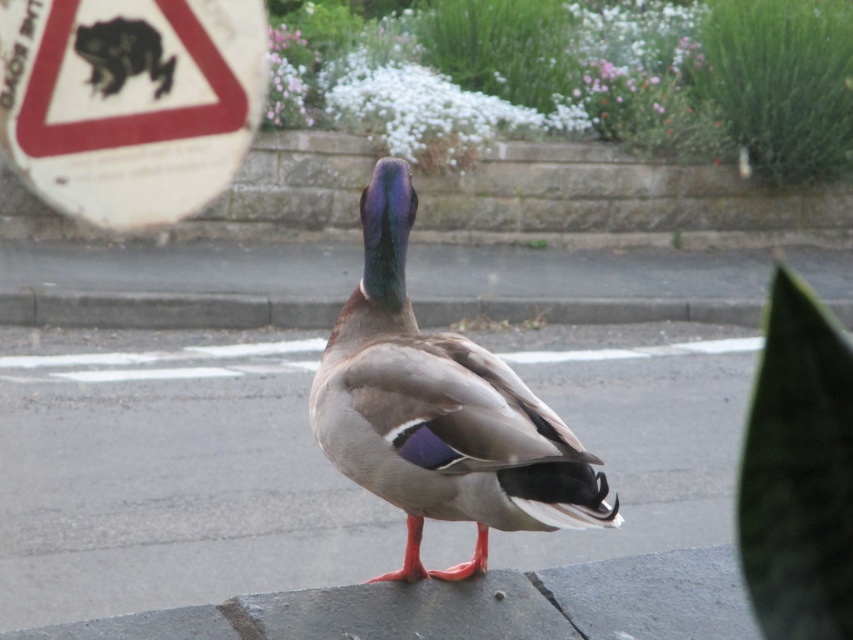
You are a pedestrian trying to cross the street and see the gray concrete pavement at center and the white paper sign at upper left. Which object is located to the right of the other?

The gray concrete pavement at center is to the right of the white paper sign at upper left.

You are a pedestrian walking on the gray concrete pavement at center and see the white paper sign at upper left. Which direction should you look to see both objects at the same time?

You should look forward because the gray concrete pavement at center is in front of the white paper sign at upper left, meaning both are visible in the forward direction.